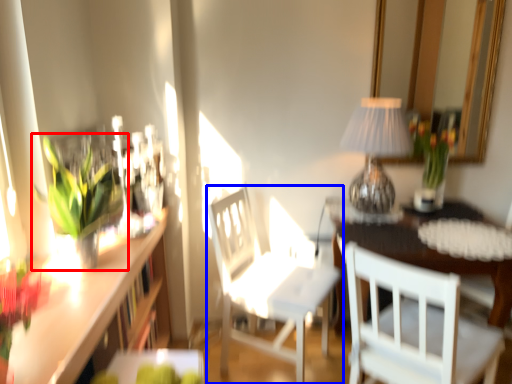
Question: Which object appears farthest to the camera in this image, houseplant (highlighted by a red box) or chair (highlighted by a blue box)?

Choices:
 (A) houseplant
 (B) chair

Answer: (B)